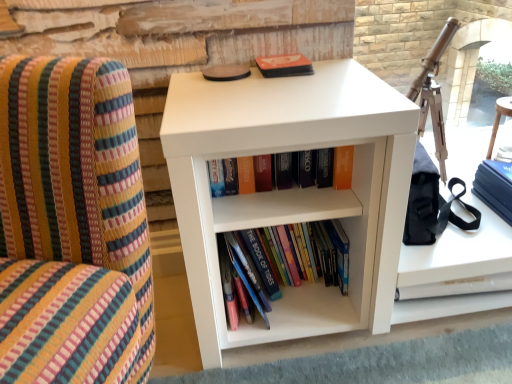
The image size is (512, 384). Find the location of `free space in front of matte orange paperback book at upper center, marked as the first paperback book in a left-to-right arrangement`. free space in front of matte orange paperback book at upper center, marked as the first paperback book in a left-to-right arrangement is located at coordinates point(296,93).